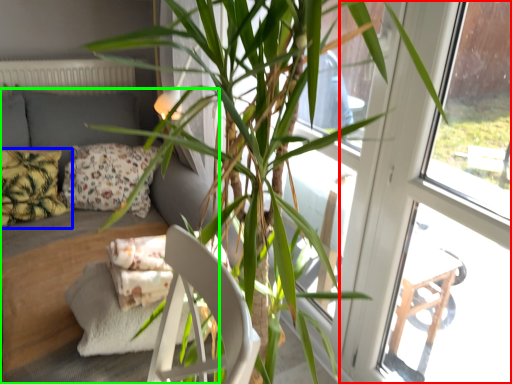
Question: Which object is the closest to the screen door (highlighted by a red box)? Choose among these: pillow (highlighted by a blue box) or studio couch (highlighted by a green box).

Choices:
 (A) pillow
 (B) studio couch

Answer: (B)